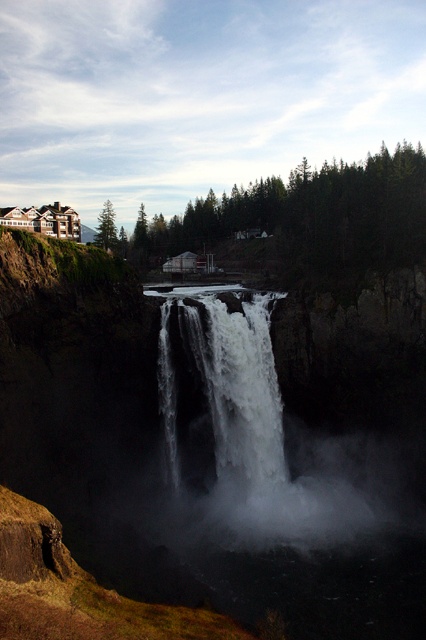
From the picture: Who is shorter, green matte tree at upper center or green matte tree at upper left?

green matte tree at upper left

Which is behind, point (307, 192) or point (97, 216)?

The point (97, 216) is more distant.

Is point (268, 200) closer to viewer compared to point (103, 224)?

No.

The height and width of the screenshot is (640, 426). Find the location of `green matte tree at upper center`. green matte tree at upper center is located at coordinates (305, 218).

This screenshot has width=426, height=640. I want to click on white misty steam at center, so click(x=262, y=440).

Is point (256, 316) farther from camera compared to point (106, 228)?

No.

The image size is (426, 640). Identify the location of white misty steam at center. (262, 440).

What are the coordinates of `white misty steam at center` in the screenshot? It's located at (262, 440).

Between white misty steam at center and white frothy water at center, which one has less height?

white frothy water at center is shorter.

Does point (176, 307) lie behind point (221, 310)?

No, (176, 307) is closer to viewer.

This screenshot has width=426, height=640. What are the coordinates of `white misty steam at center` in the screenshot? It's located at (262, 440).